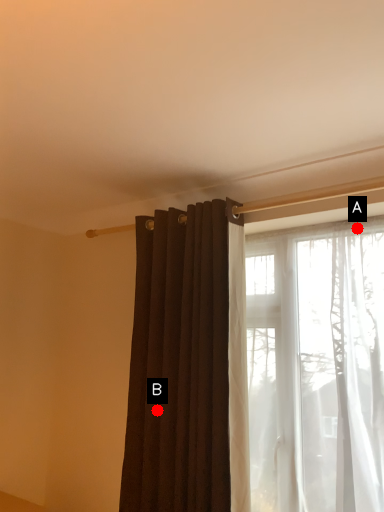
Question: Two points are circled on the image, labeled by A and B beside each circle. Which of the following is the closest to the observer?

Choices:
 (A) A is closer
 (B) B is closer

Answer: (A)